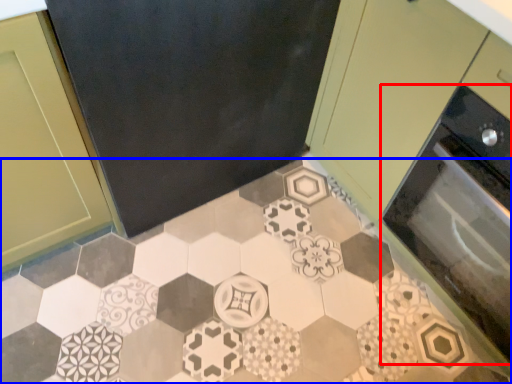
Question: Among these objects, which one is farthest to the camera, oven (highlighted by a red box) or ceramic tile (highlighted by a blue box)?

Choices:
 (A) oven
 (B) ceramic tile

Answer: (B)